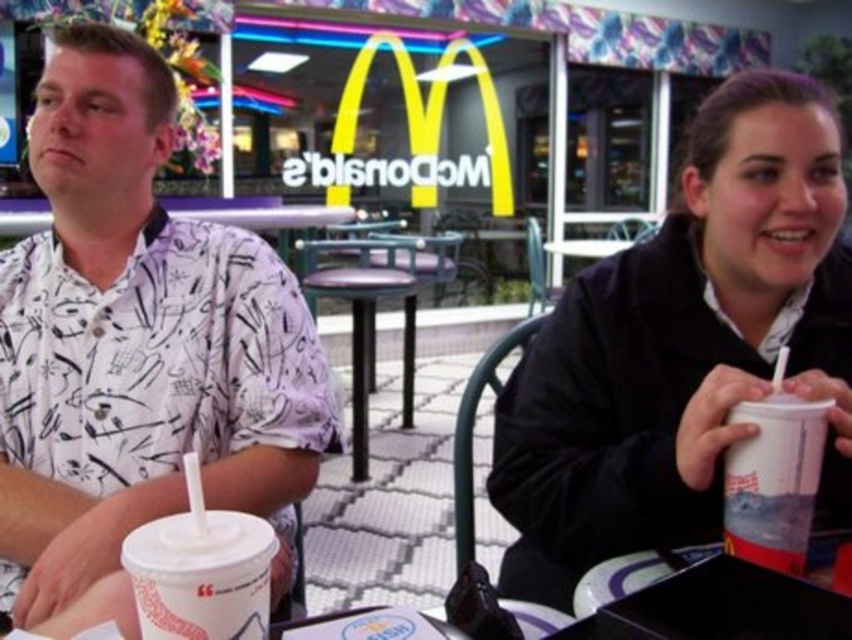
Can you confirm if white printed shirt at left is positioned to the right of translucent plastic cup at center?

In fact, white printed shirt at left is to the left of translucent plastic cup at center.

Which is in front, point (53, 177) or point (755, 164)?

Point (755, 164) is in front.

At what (x,y) coordinates should I click in order to perform the action: click on white printed shirt at left. Please return your answer as a coordinate pair (x, y). The image size is (852, 640). Looking at the image, I should click on (137, 342).

Who is more distant from viewer, [137,612] or [734,422]?

The point [734,422] is more distant.

Between white paper cup at lower left and white paper cup at right, which one appears on the left side from the viewer's perspective?

white paper cup at lower left

I want to click on white paper cup at lower left, so click(x=200, y=576).

Does translucent plastic cup at center appear under white paper cup at right?

Actually, translucent plastic cup at center is above white paper cup at right.

Is translucent plastic cup at center to the right of white paper cup at right from the viewer's perspective?

Correct, you'll find translucent plastic cup at center to the right of white paper cup at right.

Is point (547, 564) positioned after point (770, 406)?

Yes, it is behind point (770, 406).

The width and height of the screenshot is (852, 640). I want to click on translucent plastic cup at center, so click(683, 346).